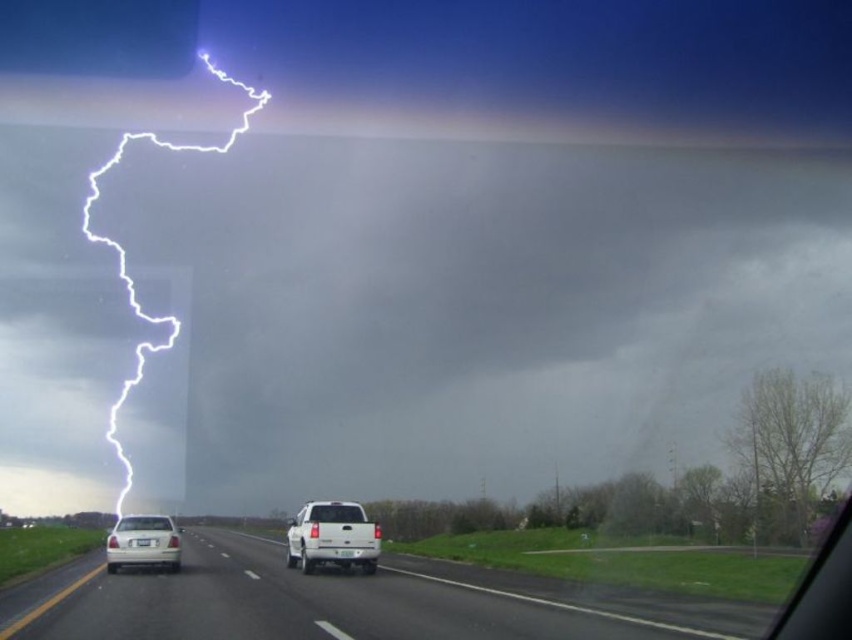
You are a weather observer standing at the center of the road. You need to determine the direction of the lightning strike relative to your position. Based on the image, where exactly is the white lightning at upper left located in terms of direction from your position?

The white lightning at upper left is located at point coordinates of (462,310), which is slightly to the left and above your position at the center of the road.

From the picture: You are a driver approaching the road in the image. You notice two points on the road ahead. Which point is closer to you, point [366,620] or point [324,518]?

Point [366,620] is closer to the viewer than point [324,518].